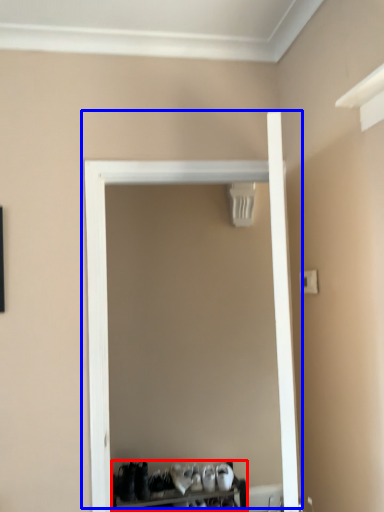
Question: Which point is closer to the camera, furniture (highlighted by a red box) or door (highlighted by a blue box)?

Choices:
 (A) furniture
 (B) door

Answer: (B)